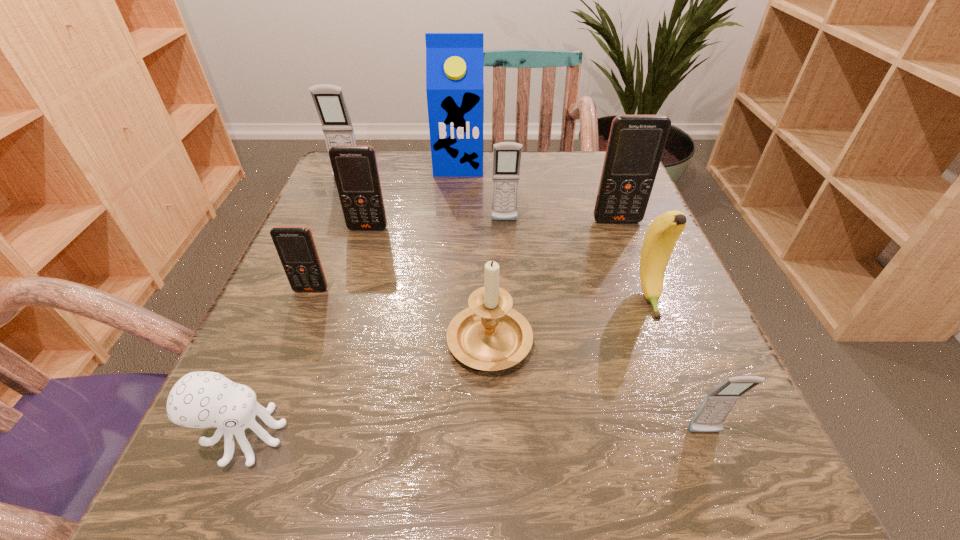
This screenshot has width=960, height=540. Find the location of `banana`. banana is located at coordinates pos(661,237).

Where is `candle holder`? The image size is (960, 540). candle holder is located at coordinates (489, 335).

What are the coordinates of `the nearest orange cellular telephone` in the screenshot? It's located at (295, 245).

Where is `the smallest orange cellular telephone`? the smallest orange cellular telephone is located at coordinates (295, 245).

The height and width of the screenshot is (540, 960). In order to click on the rightmost gray cellular telephone in this screenshot , I will do `click(716, 406)`.

At what (x,y) coordinates should I click in order to perform the action: click on the nearest cellular telephone. Please return your answer as a coordinate pair (x, y). Looking at the image, I should click on (716, 406).

The height and width of the screenshot is (540, 960). In order to click on octopus in this screenshot , I will do `click(203, 399)`.

Locate an element on the screen. The image size is (960, 540). free space located with the cap open on the blue carton is located at coordinates (456, 208).

I want to click on vacant space situated on the front-facing side of the biggest gray cellular telephone, so click(295, 308).

Image resolution: width=960 pixels, height=540 pixels. I want to click on vacant region located on the screen of the rightmost orange cellular telephone, so click(678, 378).